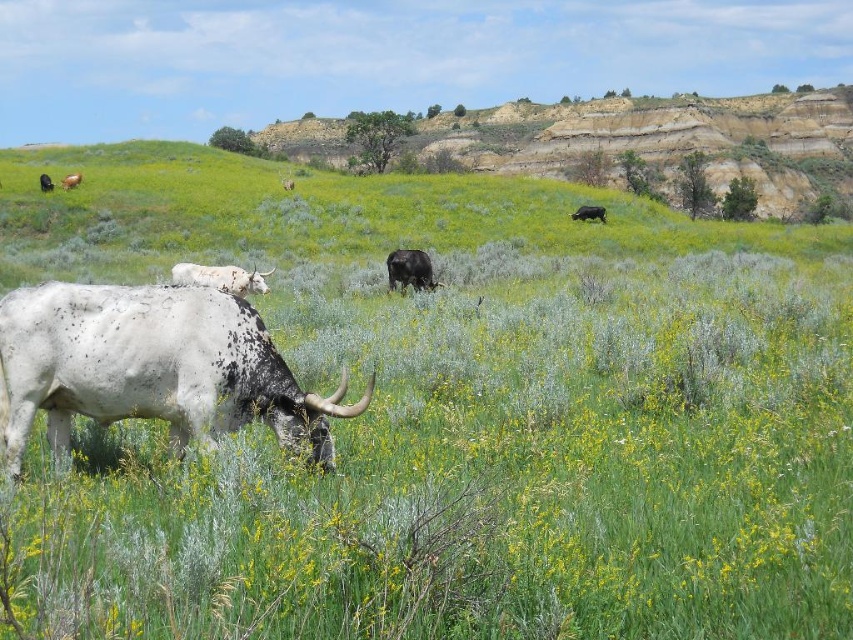
Question: Is earthy brown cliff at upper center in front of dark brown cow at upper right?

Choices:
 (A) yes
 (B) no

Answer: (B)

Question: Which object is the farthest from the speckled white bull at lower left?

Choices:
 (A) dark brown cow at upper right
 (B) white speckled cow at center
 (C) brown matte cow at upper left

Answer: (C)

Question: Is speckled white bull at lower left bigger than white speckled cow at center?

Choices:
 (A) no
 (B) yes

Answer: (B)

Question: Among these objects, which one is farthest from the camera?

Choices:
 (A) brown matte cow at upper left
 (B) speckled white bull at lower left
 (C) white speckled cow at upper left
 (D) earthy brown cliff at upper center

Answer: (D)

Question: Is earthy brown cliff at upper center further to camera compared to white speckled cow at upper left?

Choices:
 (A) no
 (B) yes

Answer: (B)

Question: Which point is farther to the camera?

Choices:
 (A) (270, 273)
 (B) (552, 125)
 (C) (44, 179)
 (D) (70, 173)

Answer: (B)